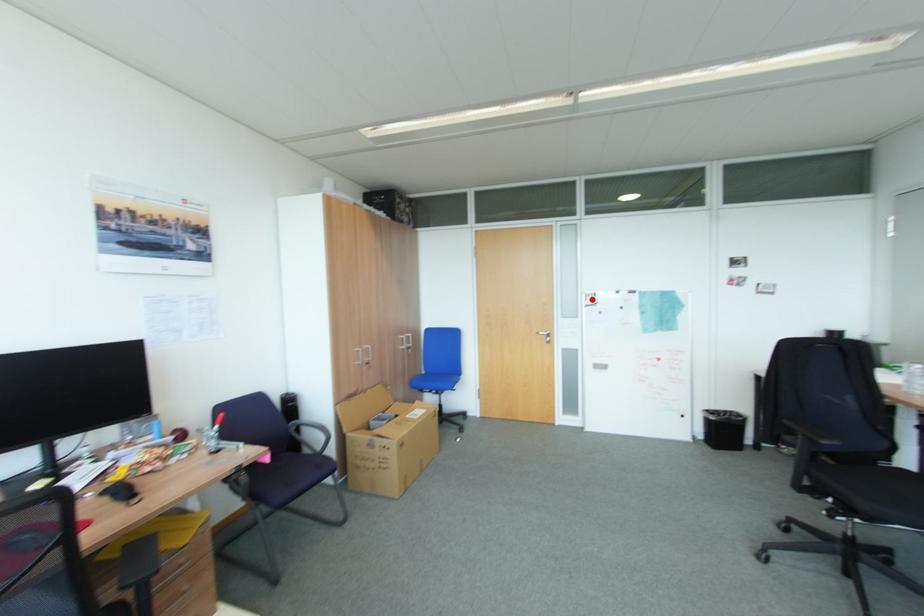
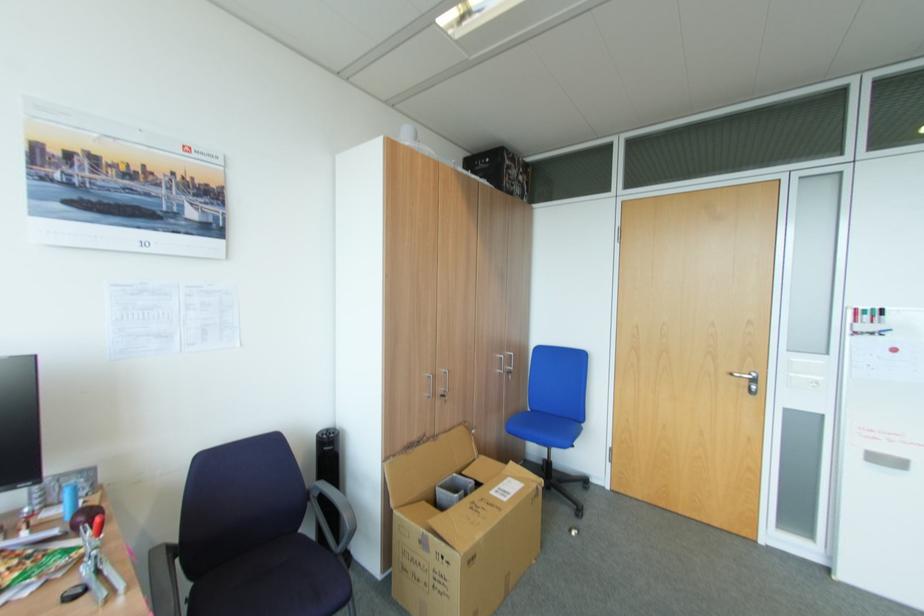
The point at the highlighted location is marked in the first image. Where is the corresponding point in the second image?

(861, 322)